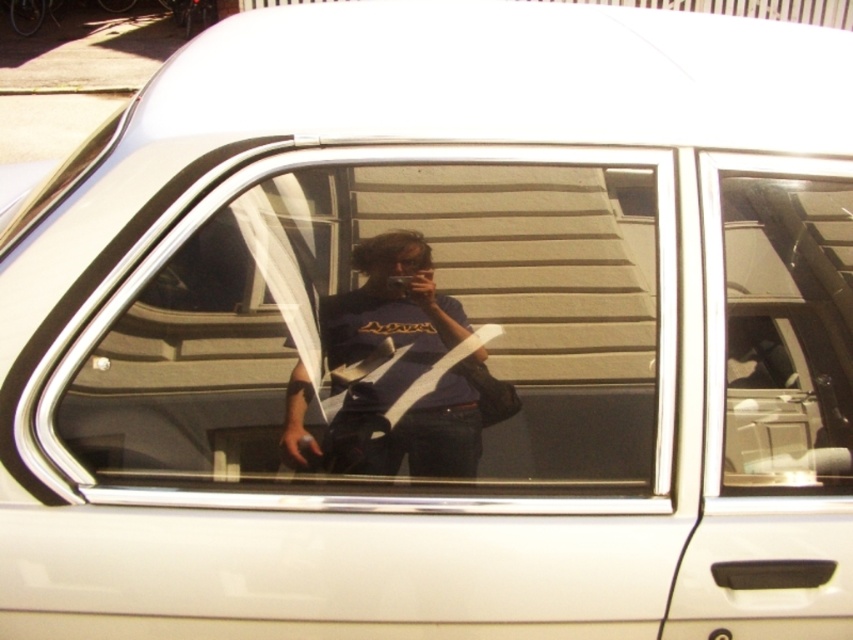
Question: Estimate the real-world distances between objects in this image. Which object is farther from the transparent glass car window at center?

Choices:
 (A) clear glass window at center
 (B) matte black t-shirt at center

Answer: (B)

Question: Does clear glass window at center have a lesser width compared to transparent glass car window at center?

Choices:
 (A) no
 (B) yes

Answer: (A)

Question: Which of the following is the farthest from the observer?

Choices:
 (A) matte black t-shirt at center
 (B) clear glass window at center

Answer: (A)

Question: Does transparent glass car window at center appear under matte black t-shirt at center?

Choices:
 (A) no
 (B) yes

Answer: (A)

Question: Among these points, which one is nearest to the camera?

Choices:
 (A) (596, 152)
 (B) (759, 243)
 (C) (376, 305)

Answer: (A)

Question: Can you confirm if clear glass window at center is wider than matte black t-shirt at center?

Choices:
 (A) no
 (B) yes

Answer: (B)